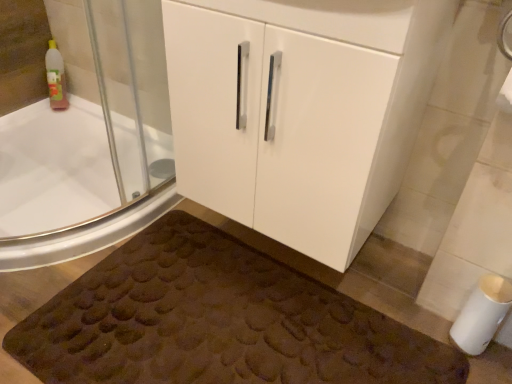
This screenshot has width=512, height=384. I want to click on white matte toilet paper at lower right, so click(482, 314).

Describe the element at coordinates (482, 314) in the screenshot. I see `white matte toilet paper at lower right` at that location.

From the picture: What is the approximate height of white glossy bathtub at upper left?

The height of white glossy bathtub at upper left is 25.54 inches.

What do you see at coordinates (301, 111) in the screenshot?
I see `white glossy cabinet at center` at bounding box center [301, 111].

Find the location of a particular element. Image resolution: width=512 pixels, height=384 pixels. white matte toilet paper at lower right is located at coordinates (482, 314).

From the image's perspective, is white glossy cabinet at center above white matte toilet paper at lower right?

Yes, from the image's perspective, white glossy cabinet at center is over white matte toilet paper at lower right.

Is white glossy cabinet at center with white matte toilet paper at lower right?

There is a gap between white glossy cabinet at center and white matte toilet paper at lower right.

Who is taller, white glossy cabinet at center or white matte toilet paper at lower right?

white glossy cabinet at center is taller.

Is white glossy cabinet at center oriented away from white matte toilet paper at lower right?

No, white glossy cabinet at center is not facing away from white matte toilet paper at lower right.

From a real-world perspective, is white matte toilet paper at lower right positioned over brown textured bath mat at lower center based on gravity?

Indeed, from a real-world perspective, white matte toilet paper at lower right stands above brown textured bath mat at lower center.

From the image's perspective, between white matte toilet paper at lower right and brown textured bath mat at lower center, which one is located above?

white matte toilet paper at lower right is shown above in the image.

Is white matte toilet paper at lower right turned away from brown textured bath mat at lower center?

No, white matte toilet paper at lower right is not facing the opposite direction of brown textured bath mat at lower center.

How many degrees apart are the facing directions of white matte toilet paper at lower right and brown textured bath mat at lower center?

The angular difference between white matte toilet paper at lower right and brown textured bath mat at lower center is 8.87 degrees.

Is white glossy bathtub at upper left not within white glossy cabinet at center?

Indeed, white glossy bathtub at upper left is completely outside white glossy cabinet at center.

Is white glossy bathtub at upper left shorter than white glossy cabinet at center?

No.

Is white glossy bathtub at upper left oriented towards white glossy cabinet at center?

Yes, white glossy bathtub at upper left is turned towards white glossy cabinet at center.

I want to click on bathroom cabinet that is in front of the white glossy bathtub at upper left, so click(x=301, y=111).

Can you confirm if white glossy cabinet at center is wider than white glossy bathtub at upper left?

Yes.

I want to click on bath that is under the white glossy cabinet at center (from a real-world perspective), so click(x=54, y=168).

Could you tell me if white glossy cabinet at center is turned towards white glossy bathtub at upper left?

No, white glossy cabinet at center does not turn towards white glossy bathtub at upper left.

Does white glossy cabinet at center touch white glossy bathtub at upper left?

No, white glossy cabinet at center is not with white glossy bathtub at upper left.

Is white glossy cabinet at center a part of white matte toilet paper at lower right?

Definitely not — white glossy cabinet at center is not inside white matte toilet paper at lower right.

Looking at the image, does white matte toilet paper at lower right seem bigger or smaller compared to white glossy cabinet at center?

In the image, white matte toilet paper at lower right appears to be smaller than white glossy cabinet at center.

Which of these two, white matte toilet paper at lower right or white glossy cabinet at center, is thinner?

Thinner between the two is white matte toilet paper at lower right.

How different are the orientations of white matte toilet paper at lower right and white glossy cabinet at center in degrees?

9.61 degrees separate the facing orientations of white matte toilet paper at lower right and white glossy cabinet at center.

Is point (247, 261) closer to camera compared to point (485, 298)?

No, (247, 261) is further to viewer.

From the picture: Does brown textured bath mat at lower center come behind white matte toilet paper at lower right?

That is False.

Is brown textured bath mat at lower center aimed at white matte toilet paper at lower right?

No, brown textured bath mat at lower center is not turned towards white matte toilet paper at lower right.

From a real-world perspective, which is physically above, brown textured bath mat at lower center or white matte toilet paper at lower right?

From a 3D spatial view, white matte toilet paper at lower right is above.

Between point (29, 336) and point (303, 22), which one is positioned behind?

Point (29, 336)

Is brown textured bath mat at lower center taller or shorter than white glossy cabinet at center?

brown textured bath mat at lower center is shorter than white glossy cabinet at center.

Is brown textured bath mat at lower center further to the viewer compared to white glossy cabinet at center?

Yes, brown textured bath mat at lower center is further from the viewer.

Is brown textured bath mat at lower center in contact with white glossy cabinet at center?

No.

Locate an element on the screen. bathroom cabinet that is above the white matte toilet paper at lower right (from the image's perspective) is located at coordinates (301, 111).

Find the location of a particular element. toilet paper that appears above the brown textured bath mat at lower center (from a real-world perspective) is located at coordinates (482, 314).

Based on their spatial positions, is white glossy bathtub at upper left or white matte toilet paper at lower right closer to brown textured bath mat at lower center?

white matte toilet paper at lower right lies closer to brown textured bath mat at lower center than the other object.

Considering their positions, is white glossy cabinet at center positioned further to white glossy bathtub at upper left than brown textured bath mat at lower center?

Based on the image, white glossy cabinet at center appears to be further to white glossy bathtub at upper left.

Looking at this image, considering their positions, is white glossy bathtub at upper left positioned closer to white glossy cabinet at center than brown textured bath mat at lower center?

Among the two, brown textured bath mat at lower center is located nearer to white glossy cabinet at center.

In the scene shown: Considering their positions, is white matte toilet paper at lower right positioned further to white glossy cabinet at center than brown textured bath mat at lower center?

Based on the image, white matte toilet paper at lower right appears to be further to white glossy cabinet at center.

Based on their spatial positions, is white glossy cabinet at center or white glossy bathtub at upper left further from white matte toilet paper at lower right?

Based on the image, white glossy bathtub at upper left appears to be further to white matte toilet paper at lower right.

Considering their positions, is white glossy bathtub at upper left positioned closer to brown textured bath mat at lower center than white glossy cabinet at center?

Based on the image, white glossy cabinet at center appears to be nearer to brown textured bath mat at lower center.

Which object lies further to the anchor point white matte toilet paper at lower right, white glossy cabinet at center or brown textured bath mat at lower center?

white glossy cabinet at center is positioned further to the anchor white matte toilet paper at lower right.

Estimate the real-world distances between objects in this image. Which object is further from white matte toilet paper at lower right, white glossy bathtub at upper left or brown textured bath mat at lower center?

white glossy bathtub at upper left is further to white matte toilet paper at lower right.

What are the coordinates of `bathroom cabinet situated between white glossy bathtub at upper left and white matte toilet paper at lower right from left to right` in the screenshot? It's located at (301, 111).

I want to click on bath mat between white glossy bathtub at upper left and white matte toilet paper at lower right, so click(216, 322).

At what (x,y) coordinates should I click in order to perform the action: click on toilet paper between white glossy cabinet at center and brown textured bath mat at lower center in the up-down direction. Please return your answer as a coordinate pair (x, y). The width and height of the screenshot is (512, 384). Looking at the image, I should click on (482, 314).

Identify the location of bath that lies between white glossy cabinet at center and brown textured bath mat at lower center from top to bottom. The width and height of the screenshot is (512, 384). (54, 168).